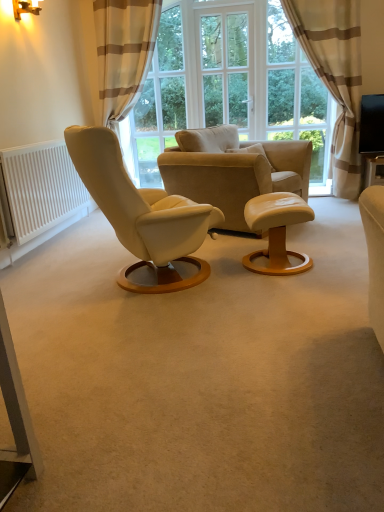
Question: Is point (157, 172) closer or farther from the camera than point (324, 47)?

Choices:
 (A) closer
 (B) farther

Answer: (A)

Question: Based on their sizes in the image, would you say transparent glass window at center, positioned as the 2th window screen in right-to-left order, is bigger or smaller than beige striped curtain at upper right, the first curtain viewed from the right?

Choices:
 (A) big
 (B) small

Answer: (B)

Question: Estimate the real-world distances between objects in this image. Which object is closer to the beige striped curtain at upper right, the first curtain viewed from the right?

Choices:
 (A) white glass window at center, which ranks as the second window screen in left-to-right order
 (B) beige striped curtain at upper left, placed as the 1th curtain when sorted from left to right
 (C) matte white stool at center
 (D) transparent glass window at center, arranged as the 1th window screen when viewed from the left
 (E) leather armchair at center

Answer: (E)

Question: Which of these objects is positioned closest to the matte white stool at center?

Choices:
 (A) white glass window at center, which ranks as the second window screen in left-to-right order
 (B) beige striped curtain at upper right, which appears as the second curtain when viewed from the left
 (C) wooden round table at center
 (D) transparent glass window at center, positioned as the 2th window screen in right-to-left order
 (E) leather armchair at center

Answer: (E)